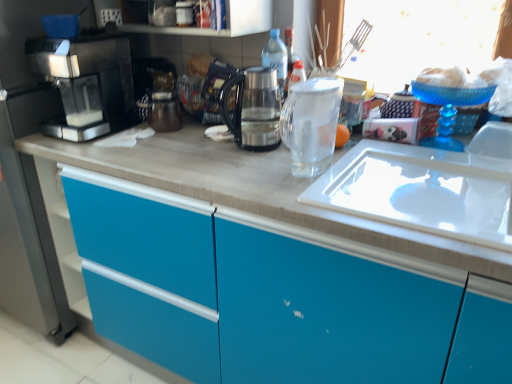
At what (x,y) coordinates should I click in order to perform the action: click on free space above white glossy sink at center right (from a real-world perspective). Please return your answer as a coordinate pair (x, y). This screenshot has height=384, width=512. Looking at the image, I should click on (412, 173).